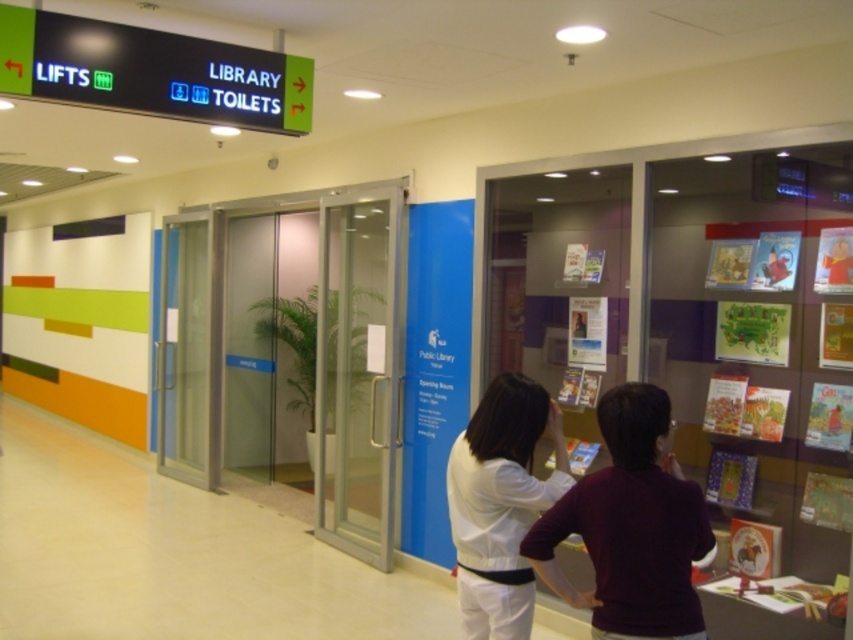
Does transparent glass elevator at center appear on the right side of white matte shirt at center?

In fact, transparent glass elevator at center is to the left of white matte shirt at center.

Which is more to the right, transparent glass elevator at center or white matte shirt at center?

From the viewer's perspective, white matte shirt at center appears more on the right side.

Does point (221, 248) lie in front of point (485, 403)?

No.

The height and width of the screenshot is (640, 853). What are the coordinates of `transparent glass elevator at center` in the screenshot? It's located at (289, 349).

Can you confirm if transparent glass elevator at center is smaller than maroon sweater at center?

Incorrect, transparent glass elevator at center is not smaller in size than maroon sweater at center.

Can you confirm if transparent glass elevator at center is positioned below maroon sweater at center?

No, transparent glass elevator at center is not below maroon sweater at center.

The image size is (853, 640). What are the coordinates of `transparent glass elevator at center` in the screenshot? It's located at (289, 349).

Where is `transparent glass elevator at center`? The height and width of the screenshot is (640, 853). transparent glass elevator at center is located at coordinates pyautogui.click(x=289, y=349).

Does point (635, 504) come behind point (514, 531)?

That is False.

Between point (676, 515) and point (480, 609), which one is positioned in front?

Point (676, 515)

The width and height of the screenshot is (853, 640). I want to click on maroon sweater at center, so click(630, 525).